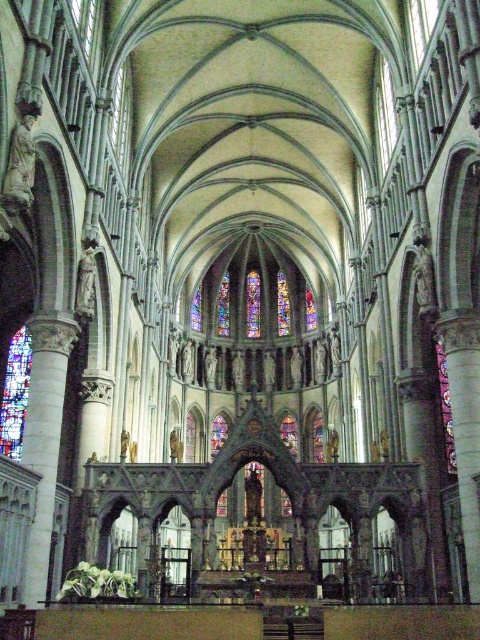
Based on the photo, does transparent stained glass at center appear under stained glass window at center?

Correct, transparent stained glass at center is located below stained glass window at center.

Is point (181, 561) positioned behind point (451, 419)?

Yes, point (181, 561) is behind point (451, 419).

Is point (184, 576) closer to camera compared to point (447, 390)?

That is False.

The height and width of the screenshot is (640, 480). Identify the location of transparent stained glass at center. (175, 556).

Who is more distant from viewer, (454, 448) or (224, 296)?

Point (224, 296)

Does stained glass window at center come behind stained glass at center?

No, stained glass window at center is closer to the viewer.

You are a GUI agent. You are given a task and a screenshot of the screen. Output one action in this format:
    pyautogui.click(x=<x>, y=<y>)
    Task: Click on the stained glass window at center
    
    Given the screenshot: What is the action you would take?
    pyautogui.click(x=445, y=408)

Is transparent stained glass at upper center taller than stained glass window at center?

No, transparent stained glass at upper center is not taller than stained glass window at center.

Can you confirm if transparent stained glass at upper center is positioned to the left of stained glass window at center?

Yes, transparent stained glass at upper center is to the left of stained glass window at center.

Describe the element at coordinates (384, 116) in the screenshot. I see `transparent stained glass at upper center` at that location.

At what (x,y) coordinates should I click in order to perform the action: click on transparent stained glass at upper center. Please return your answer as a coordinate pair (x, y). The width and height of the screenshot is (480, 640). Looking at the image, I should click on (384, 116).